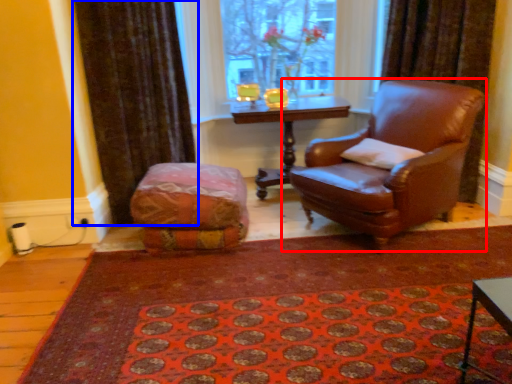
Question: Which object is closer to the camera taking this photo, chair (highlighted by a red box) or curtain (highlighted by a blue box)?

Choices:
 (A) chair
 (B) curtain

Answer: (A)